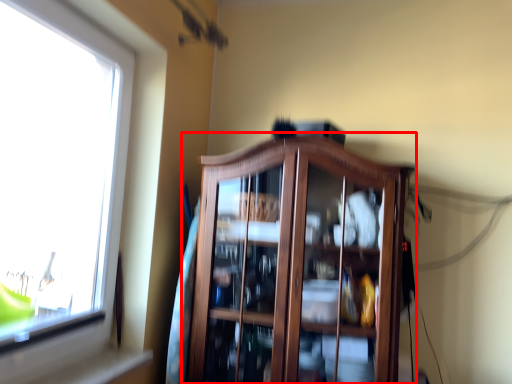
Question: From the image's perspective, what is the correct spatial positioning of dresser (annotated by the red box) in reference to window?

Choices:
 (A) above
 (B) below

Answer: (B)